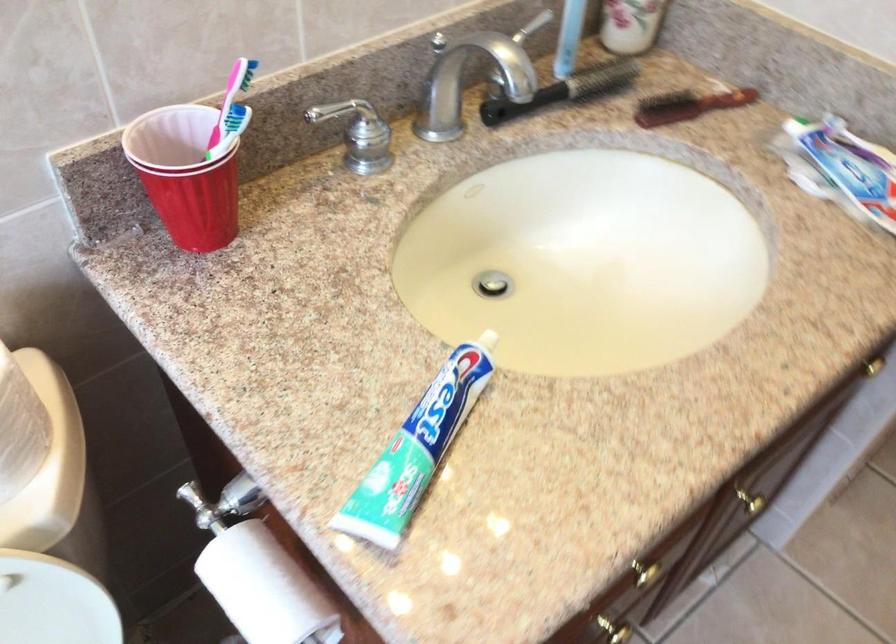
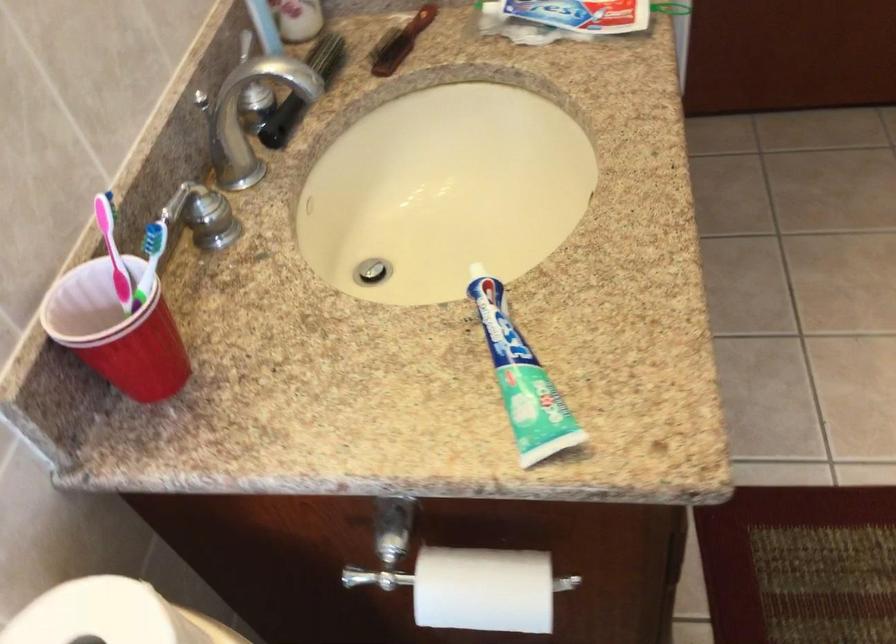
In the second image, find the point that corresponds to point 685,107 in the first image.

(400, 42)